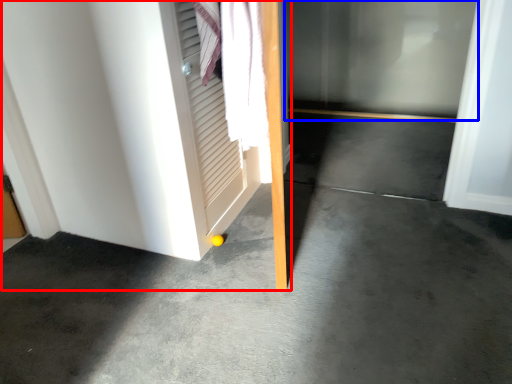
Question: Which object appears closest to the camera in this image, door (highlighted by a red box) or glass door (highlighted by a blue box)?

Choices:
 (A) door
 (B) glass door

Answer: (A)